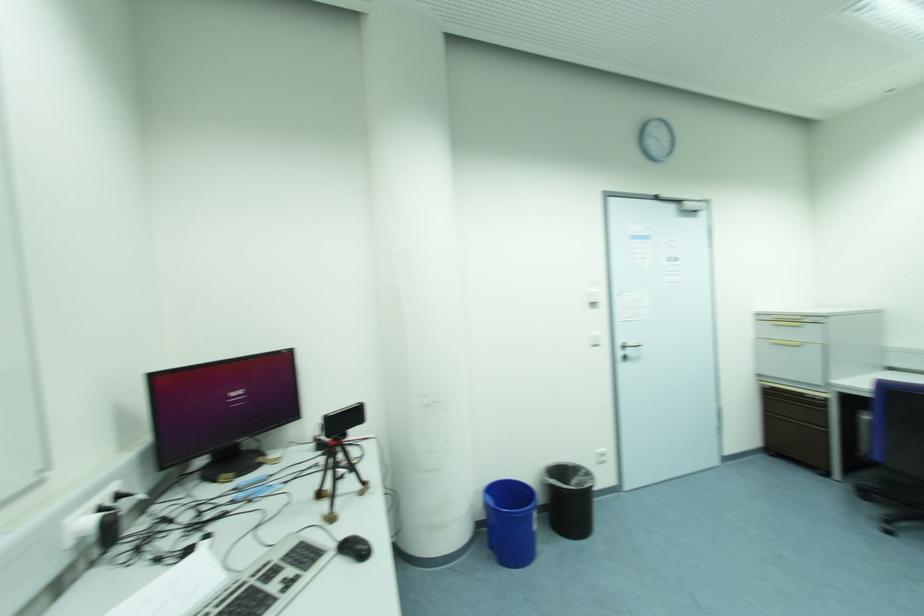
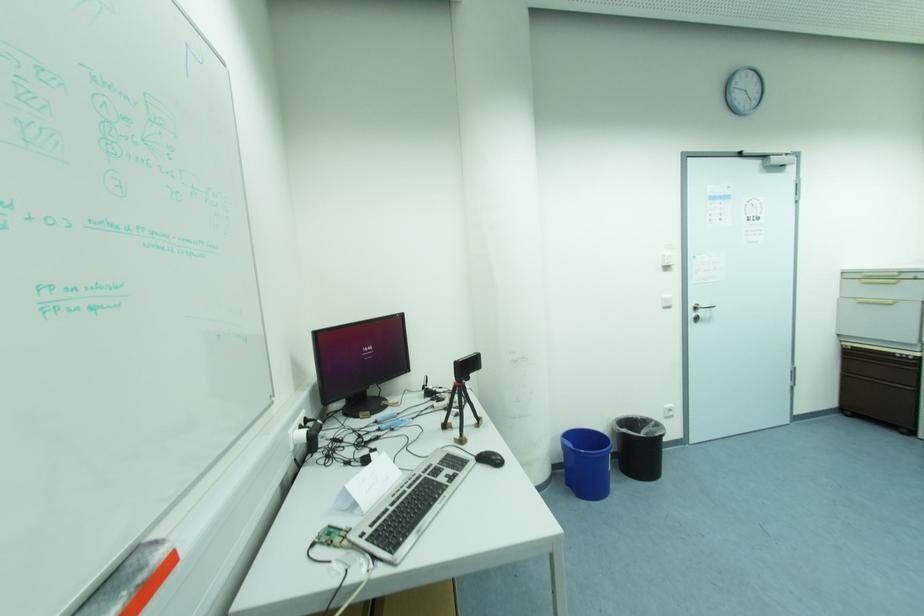
In the second image, find the point that corresponds to (626,347) in the first image.

(697, 309)